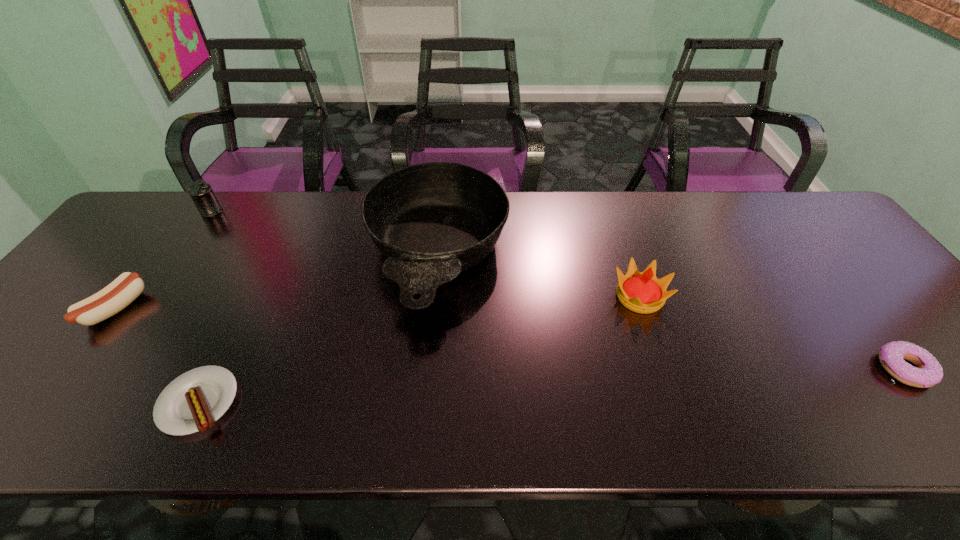
This screenshot has height=540, width=960. Find the location of `vacant space that satisfies the following two spatial constraints: 1. on the back side of the nearer sausage; 2. on the left side of the doughnut`. vacant space that satisfies the following two spatial constraints: 1. on the back side of the nearer sausage; 2. on the left side of the doughnut is located at coordinates (215, 369).